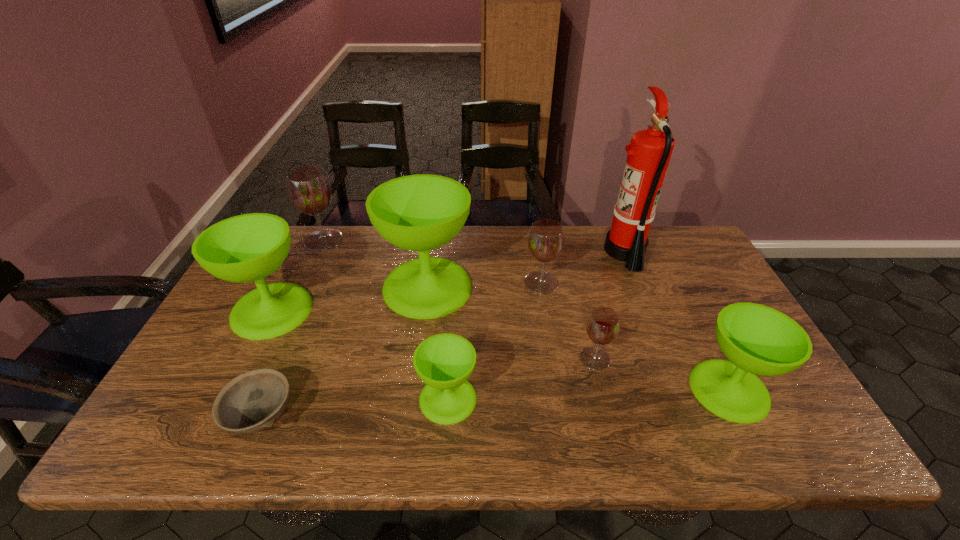
At what (x,y) coordinates should I click in order to perform the action: click on green wineglass that is the third closest one to the smallest red wineglass. Please return your answer as a coordinate pair (x, y). This screenshot has width=960, height=540. Looking at the image, I should click on (422, 212).

Locate which red wineglass is the third closest to the gray bowl. Please provide its 2D coordinates. Your answer should be formatted as a tuple, i.e. [(x, y)], where the tuple contains the x and y coordinates of a point satisfying the conditions above.

[(603, 325)]

Where is `red wineglass identified as the closest to the second biggest green wineglass`? red wineglass identified as the closest to the second biggest green wineglass is located at coordinates (308, 187).

Locate an element on the screen. The image size is (960, 540). vacant space that satisfies the following two spatial constraints: 1. on the back side of the gray bowl; 2. on the right side of the sixth object from left to right is located at coordinates pyautogui.click(x=318, y=282).

Find the location of a particular element. Image resolution: width=960 pixels, height=540 pixels. free point that satisfies the following two spatial constraints: 1. on the back side of the second smallest green wineglass; 2. on the right side of the smallest green wineglass is located at coordinates (448, 390).